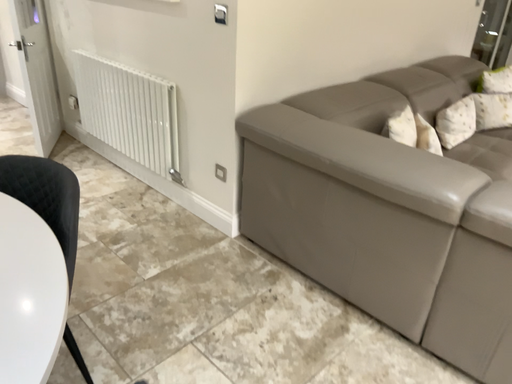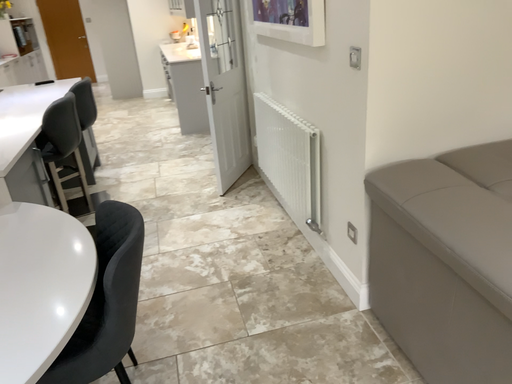
Question: Which way did the camera rotate in the video?

Choices:
 (A) rotated left
 (B) rotated right

Answer: (A)